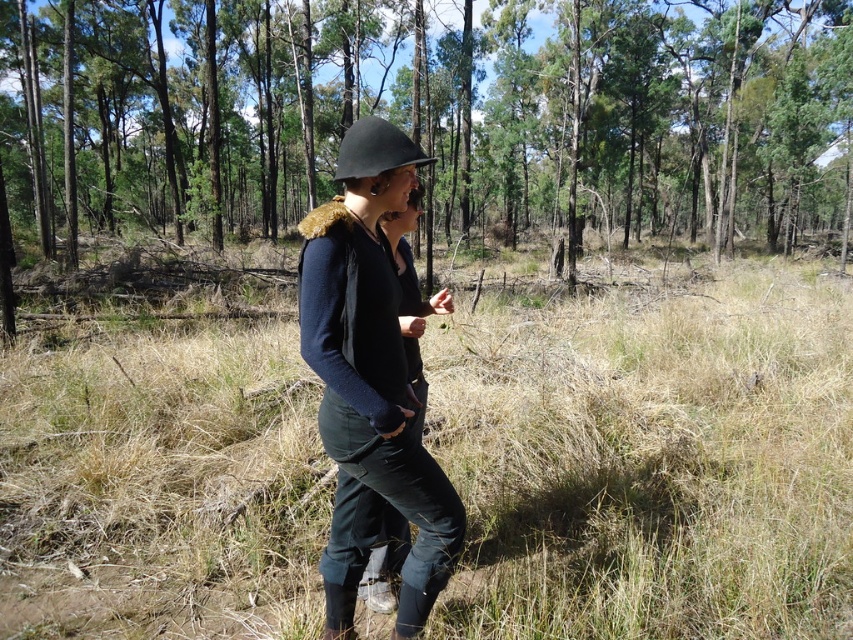
Question: Is matte black helmet at center wider than black matte helmet at center?

Choices:
 (A) no
 (B) yes

Answer: (B)

Question: Can you confirm if green grass at center is wider than matte black helmet at center?

Choices:
 (A) yes
 (B) no

Answer: (A)

Question: Which object appears farthest from the camera in this image?

Choices:
 (A) black matte helmet at center
 (B) matte black helmet at center

Answer: (A)

Question: Among these objects, which one is farthest from the camera?

Choices:
 (A) dry grass at center
 (B) black matte helmet at center
 (C) matte black helmet at center
 (D) green grass at center

Answer: (A)

Question: Can you confirm if green grass at center is smaller than matte black helmet at center?

Choices:
 (A) no
 (B) yes

Answer: (A)

Question: Which is farther from the matte black helmet at center?

Choices:
 (A) black matte helmet at center
 (B) dry grass at center

Answer: (B)